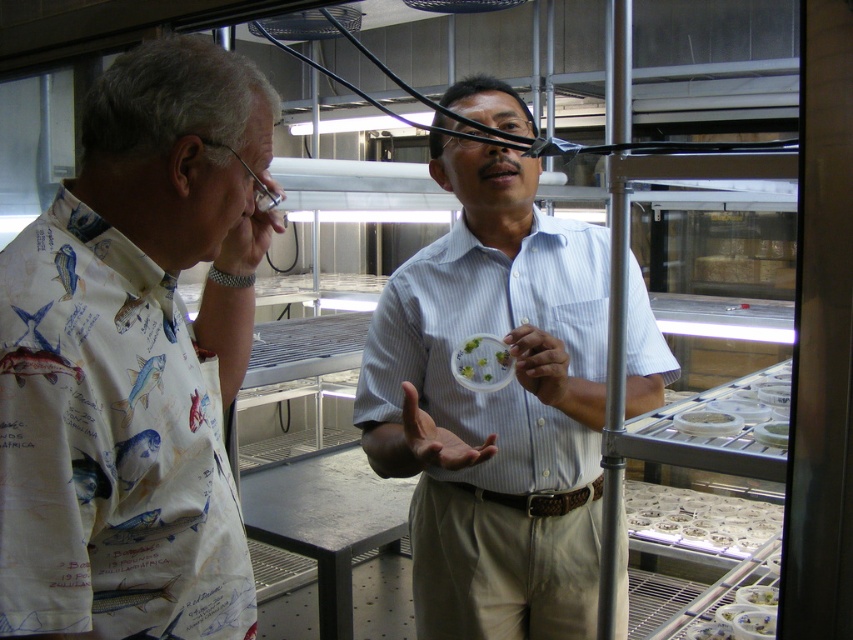
Based on the photo, can you confirm if translucent plastic container at center is shorter than white matte container at center?

No, translucent plastic container at center is not shorter than white matte container at center.

Can you confirm if translucent plastic container at center is wider than white matte container at center?

No, translucent plastic container at center is not wider than white matte container at center.

Is point (490, 358) positioned in front of point (721, 412)?

No.

I want to click on translucent plastic container at center, so click(x=480, y=364).

Which is in front, point (112, 298) or point (469, 339)?

Point (112, 298) is more forward.

Is point (206, 260) farther from camera compared to point (469, 349)?

No, it is in front of (469, 349).

Describe the element at coordinates (135, 358) in the screenshot. I see `white printed shirt at left` at that location.

The width and height of the screenshot is (853, 640). I want to click on white printed shirt at left, so click(135, 358).

Can you confirm if white striped shirt at center is taller than translucent plastic container at center?

Indeed, white striped shirt at center has a greater height compared to translucent plastic container at center.

Does point (479, 112) lie behind point (485, 358)?

Yes, point (479, 112) is behind point (485, 358).

This screenshot has height=640, width=853. I want to click on white striped shirt at center, so click(495, 406).